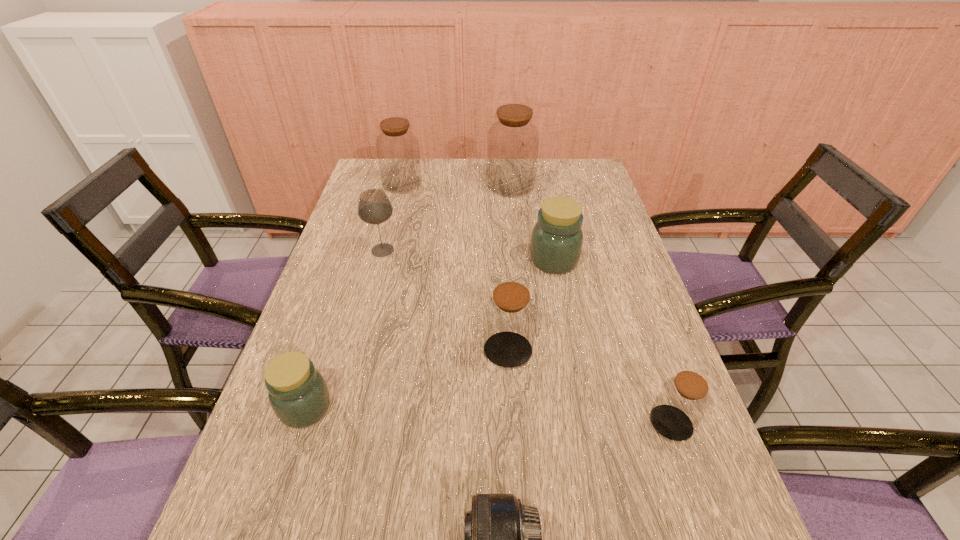
Locate an element on the screen. free region that satisfies the following two spatial constraints: 1. on the front side of the seventh shortest object; 2. on the right side of the farther green jar is located at coordinates (383, 260).

What are the coordinates of `vacant position in the image that satisfies the following two spatial constraints: 1. on the back side of the tallest object; 2. on the right side of the gray wineglass` in the screenshot? It's located at (399, 185).

Locate an element on the screen. Image resolution: width=960 pixels, height=540 pixels. blank space that satisfies the following two spatial constraints: 1. on the front side of the smaller green jar; 2. on the right side of the smallest brown jar is located at coordinates (300, 423).